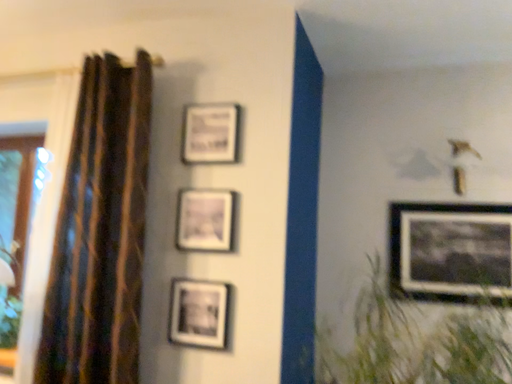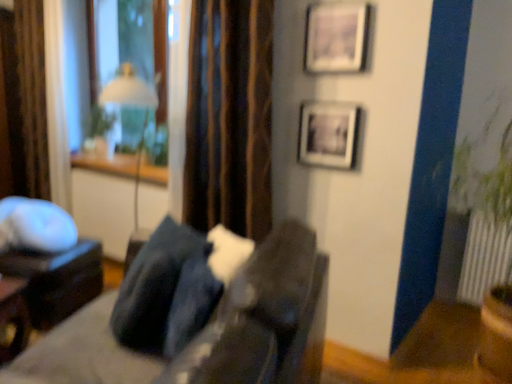
Question: Which way did the camera rotate in the video?

Choices:
 (A) rotated upward
 (B) rotated downward

Answer: (B)